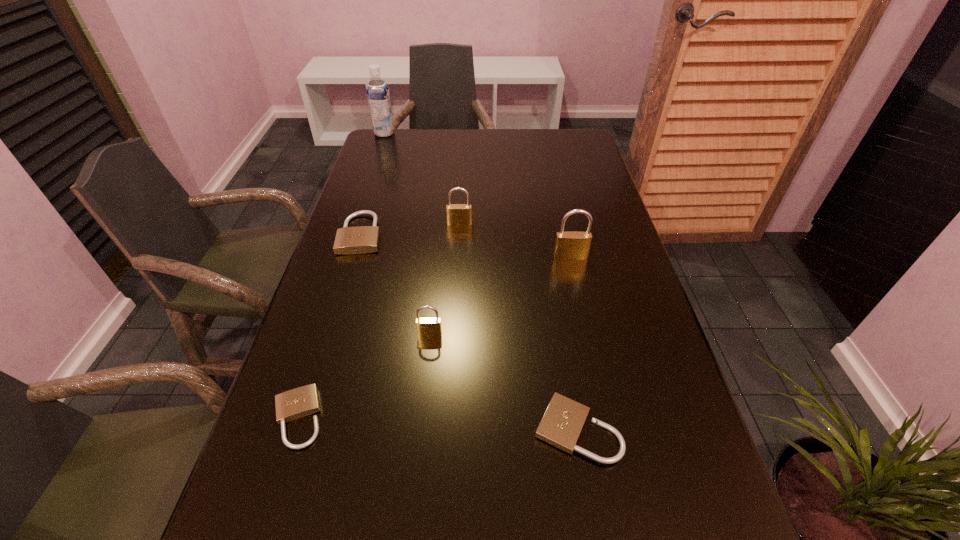
You are a GUI agent. You are given a task and a screenshot of the screen. Output one action in this format:
    pyautogui.click(x=<x>, y=<y>)
    Task: Click on the blank space located on the right of the smallest beige padlock
    
    Given the screenshot: What is the action you would take?
    pyautogui.click(x=361, y=418)

This screenshot has height=540, width=960. I want to click on object present at the far edge, so click(x=378, y=96).

Locate an element on the screen. This screenshot has width=960, height=540. soya milk that is at the left edge is located at coordinates (378, 96).

Locate an element on the screen. This screenshot has width=960, height=540. object situated at the far left corner is located at coordinates (378, 96).

This screenshot has height=540, width=960. I want to click on vacant area at the far edge, so click(x=451, y=142).

The height and width of the screenshot is (540, 960). Find the location of `vacant area at the left edge`. vacant area at the left edge is located at coordinates (372, 195).

You are a GUI agent. You are given a task and a screenshot of the screen. Output one action in this format:
    pyautogui.click(x=<x>, y=<y>)
    Task: Click on the free space at the right edge
    This screenshot has height=540, width=960.
    Given the screenshot: What is the action you would take?
    pyautogui.click(x=655, y=529)

What are the coordinates of `blank area at the far left corner` in the screenshot? It's located at (397, 130).

The height and width of the screenshot is (540, 960). In the image, there is a desktop. What are the coordinates of `vacant space at the far right corner` in the screenshot? It's located at (583, 147).

In order to click on vacant point located between the second biggest brass padlock and the biggest beige padlock in this screenshot , I will do `click(411, 228)`.